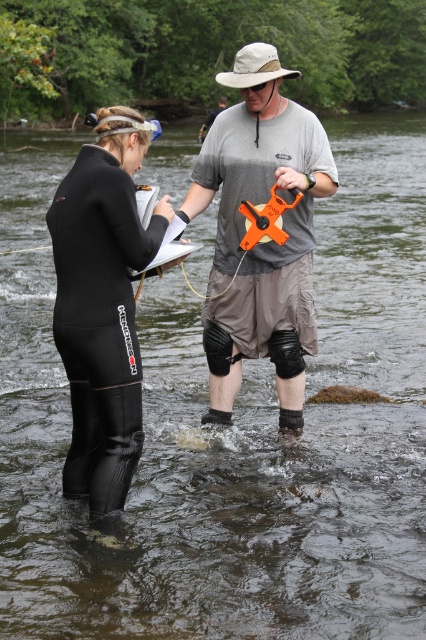
What is located at the point with coordinates (x=261, y=237) in the image?

The gray fabric shirt at center is located at point (x=261, y=237).

You are a photographer trying to capture both the gray fabric shirt at center and the black neoprene wetsuit at left in the same frame. Which clothing item is positioned higher in the image?

The gray fabric shirt at center is positioned higher in the image than the black neoprene wetsuit at left, as it is above it.

You are a photographer trying to capture both the gray fabric shirt at center and the black neoprene wetsuit at left in a single frame. Which clothing item should you focus on first to ensure it appears larger in the photo?

The gray fabric shirt at center has a greater height compared to the black neoprene wetsuit at left, so you should focus on the gray fabric shirt at center first to ensure it appears larger in the photo.